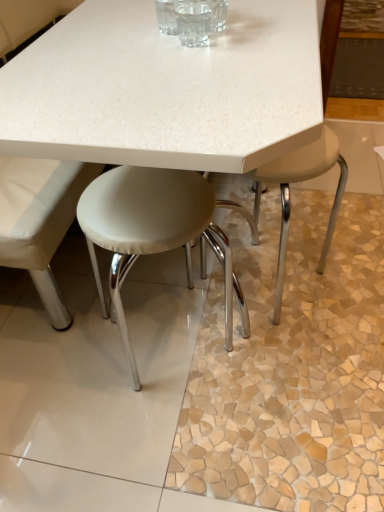
This screenshot has height=512, width=384. What are the coordinates of `free space to the right of transparent glass at center` in the screenshot? It's located at (261, 39).